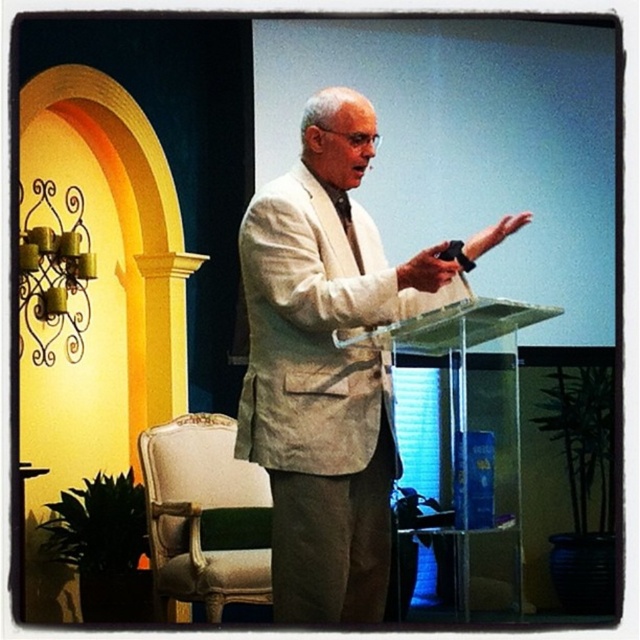
Based on the scene description, can you determine whether the white textured suit at center is covering part of the light beige fabric armchair at lower left?

Yes, the white textured suit at center is positioned over the light beige fabric armchair at lower left, indicating that it is covering part of the armchair.

You are a photographer setting up for an event. You need to ensure that the white textured suit at center is visible in the frame without being blocked by the transparent acrylic podium at center. Based on their sizes, which object should you adjust to achieve this?

The white textured suit at center has a larger size compared to the transparent acrylic podium at center. To ensure visibility, you should position the transparent acrylic podium at center slightly behind or to the side of the white textured suit at center so it doesn not obstruct the larger suit.

You are standing at the podium where the man is speaking. You need to move to the light beige fabric armchair at lower left. Which direction should you walk to reach it?

The light beige fabric armchair at lower left is located at point (200,516). Since the coordinates are based on the image plane, the lower left direction from the podium would be the correct path to reach it.